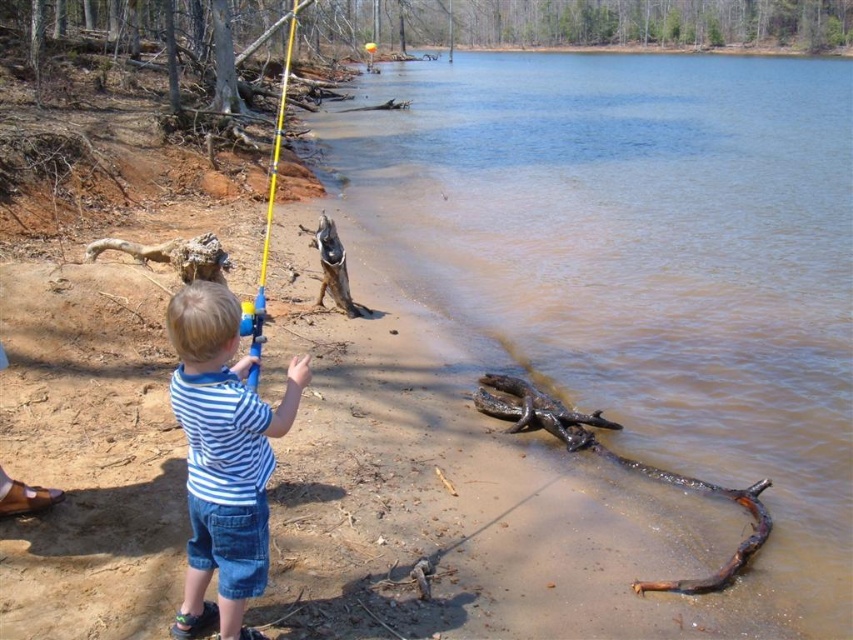
Does blue striped shirt at center have a lesser width compared to brown rough log at lower right?

Yes.

Does blue striped shirt at center appear on the right side of brown rough log at lower right?

Incorrect, blue striped shirt at center is not on the right side of brown rough log at lower right.

This screenshot has width=853, height=640. I want to click on blue striped shirt at center, so click(x=223, y=456).

Where is `blue striped shirt at center`? blue striped shirt at center is located at coordinates (223, 456).

Which is more to the left, brown muddy water at lower center or brown rough log at lower right?

Positioned to the left is brown rough log at lower right.

Who is taller, brown muddy water at lower center or brown rough log at lower right?

With more height is brown muddy water at lower center.

Between point (599, 118) and point (618, 460), which one is positioned in front?

Point (618, 460) is in front.

This screenshot has width=853, height=640. Find the location of `brown muddy water at lower center`. brown muddy water at lower center is located at coordinates (643, 260).

Is brown muddy water at lower center thinner than blue striped shirt at center?

Incorrect, brown muddy water at lower center's width is not less than blue striped shirt at center's.

Between brown muddy water at lower center and blue striped shirt at center, which one has less height?

blue striped shirt at center

Between point (815, 554) and point (231, 477), which one is positioned in front?

Point (231, 477) is more forward.

At what (x,y) coordinates should I click in order to perform the action: click on brown muddy water at lower center. Please return your answer as a coordinate pair (x, y). Image resolution: width=853 pixels, height=640 pixels. Looking at the image, I should click on (643, 260).